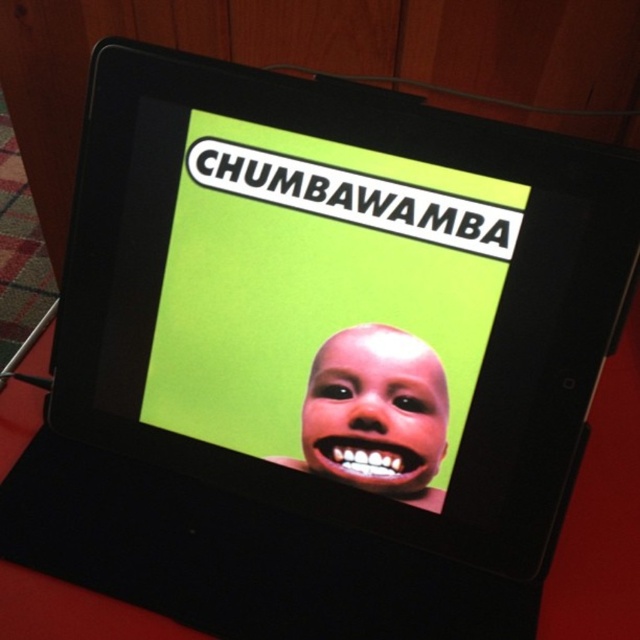
You are designing a poster for a music festival and want to ensure the band name is clearly visible. Given the green matte poster at center and the smooth skin face at center, which object should you focus on to make sure the text is legible?

The green matte poster at center is much taller than the smooth skin face at center, so focusing on the green matte poster at center ensures the text will be large enough for legibility.

You are designing a layout for a poster and want to place a green matte poster at center. According to the image, where should you position it to match the original design?

The green matte poster at center should be positioned at point (324, 301) to match the original design.